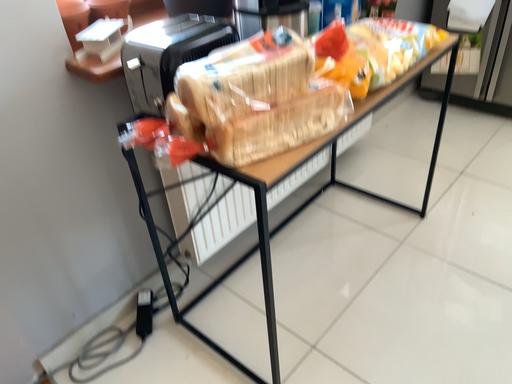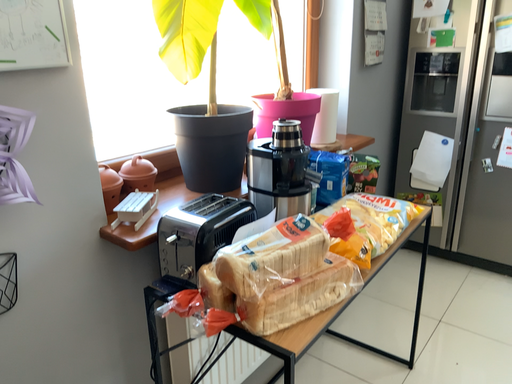
Question: Which way did the camera rotate in the video?

Choices:
 (A) rotated upward
 (B) rotated downward

Answer: (A)